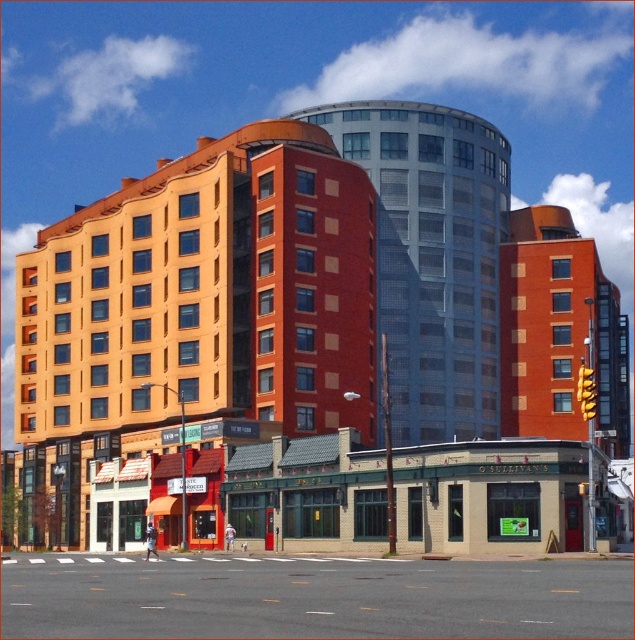
You are standing at the pedestrian crossing in the foreground of the urban scene. There are two points marked in the image, point [110,467] and point [578,301]. Which point is closer to you?

Point [110,467] is closer to the viewer than point [578,301].